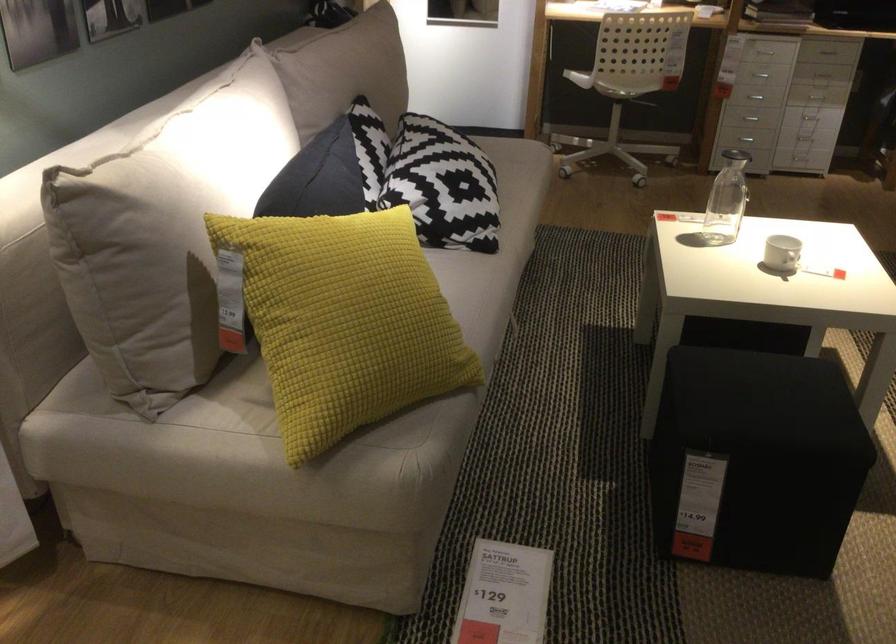
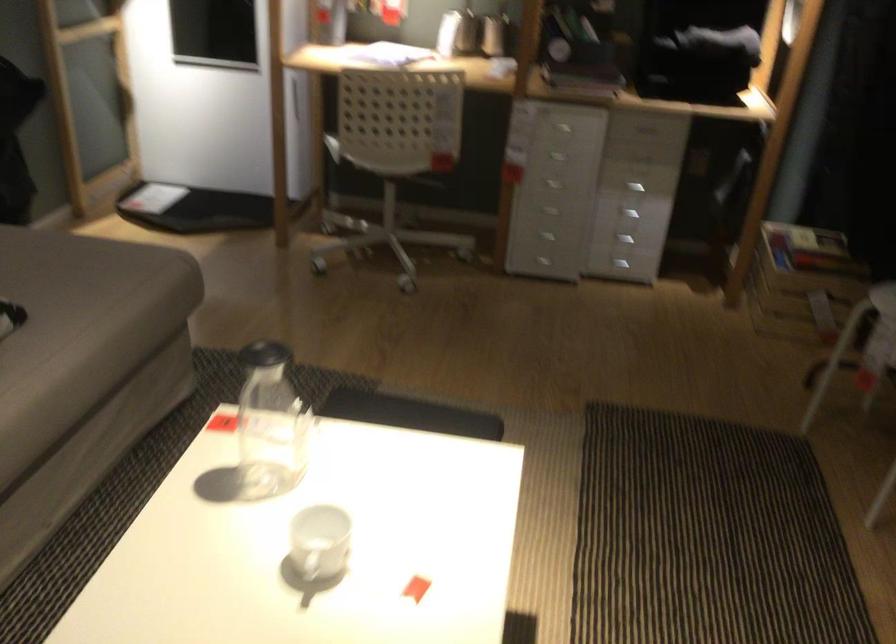
The point at (816, 124) is marked in the first image. Where is the corresponding point in the second image?

(625, 240)